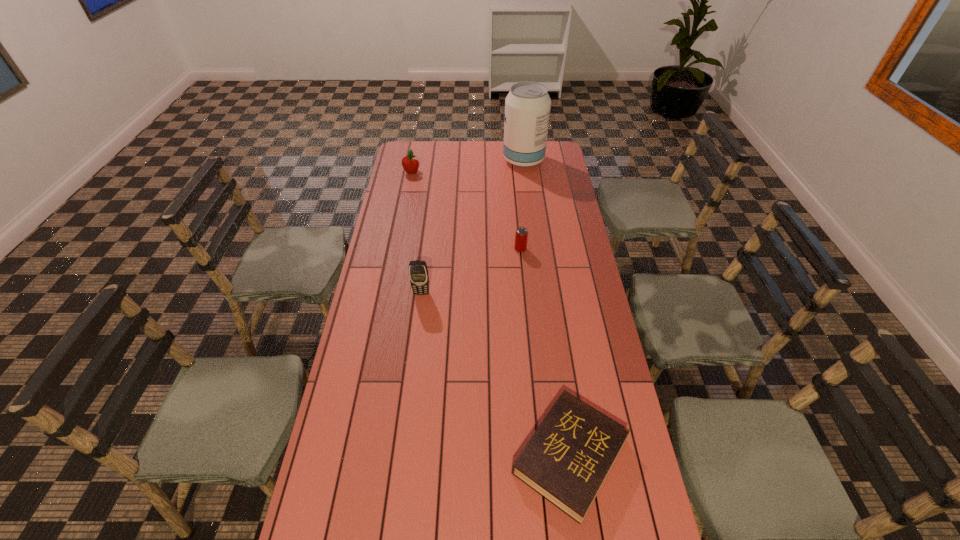
This screenshot has height=540, width=960. Find the location of `the tallest object`. the tallest object is located at coordinates (527, 106).

I want to click on the second object from left to right, so click(418, 273).

Locate an element on the screen. This screenshot has height=540, width=960. cellular telephone is located at coordinates (418, 273).

The height and width of the screenshot is (540, 960). I want to click on the leftmost object, so click(410, 163).

This screenshot has height=540, width=960. Find the location of `beer can`. beer can is located at coordinates (521, 235).

This screenshot has height=540, width=960. I want to click on the shortest object, so click(x=567, y=459).

Find the location of a particular element. The height and width of the screenshot is (540, 960). the nearest object is located at coordinates (567, 459).

Where is `free space located on the front of the alcohol`? The width and height of the screenshot is (960, 540). free space located on the front of the alcohol is located at coordinates (529, 202).

The image size is (960, 540). What are the coordinates of `free space located on the front face of the fourth farthest object` in the screenshot? It's located at (420, 306).

Identify the location of free space located on the right of the apple. (472, 172).